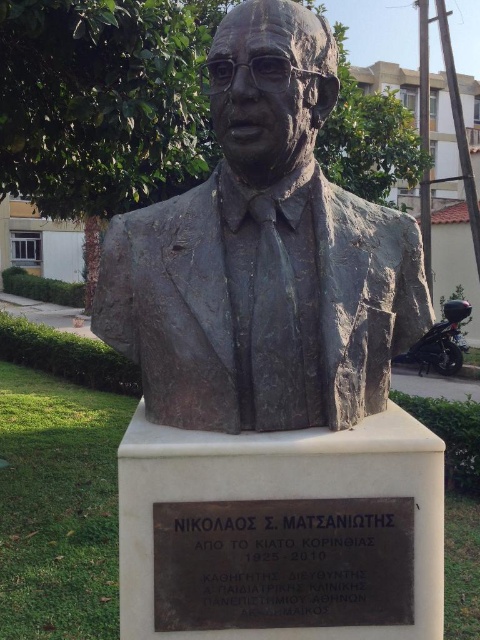
Question: Which point is closer to the camera?

Choices:
 (A) (263, 552)
 (B) (300, 160)

Answer: (A)

Question: Is bronze statue at center bigger than black metal plaque at center?

Choices:
 (A) no
 (B) yes

Answer: (B)

Question: Which object appears closest to the camera in this image?

Choices:
 (A) bronze statue at center
 (B) black metal plaque at center

Answer: (A)

Question: Is bronze statue at center behind black metal plaque at center?

Choices:
 (A) yes
 (B) no

Answer: (B)

Question: Can you confirm if bronze statue at center is smaller than black metal plaque at center?

Choices:
 (A) yes
 (B) no

Answer: (B)